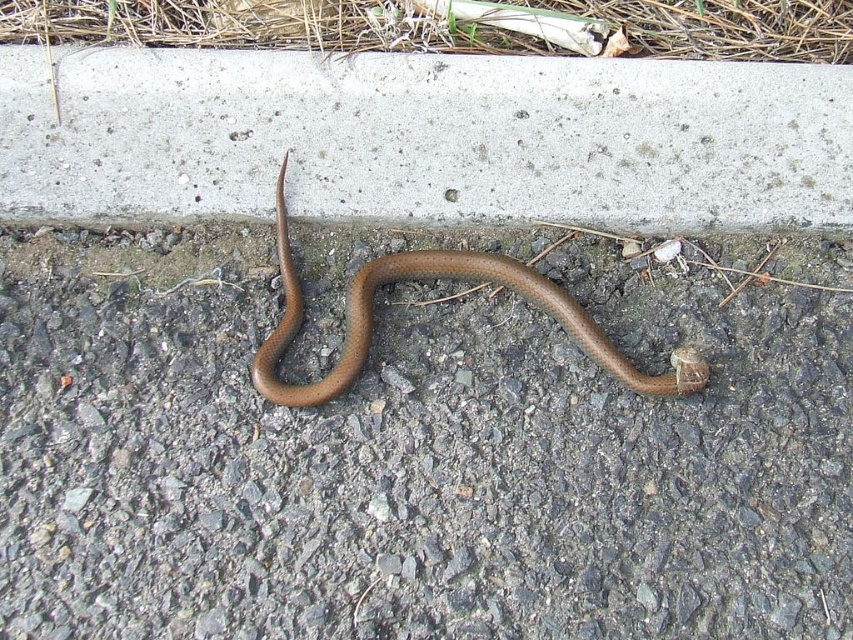
Question: Which point is farther from the camera taking this photo?

Choices:
 (A) (670, 124)
 (B) (476, 259)
 (C) (543, 556)
 (D) (721, 12)

Answer: (D)

Question: Is green grass at upper center below brown matte snake at center?

Choices:
 (A) yes
 (B) no

Answer: (B)

Question: Can you confirm if brown rubber snake at lower center is wider than gray concrete curb at upper center?

Choices:
 (A) no
 (B) yes

Answer: (B)

Question: In this image, where is brown rubber snake at lower center located relative to green grass at upper center?

Choices:
 (A) below
 (B) above

Answer: (A)

Question: Which of the following is the farthest from the observer?

Choices:
 (A) brown matte snake at center
 (B) gray concrete curb at upper center
 (C) green grass at upper center
 (D) brown rubber snake at lower center

Answer: (C)

Question: Considering the real-world distances, which object is farthest from the brown matte snake at center?

Choices:
 (A) brown rubber snake at lower center
 (B) green grass at upper center
 (C) gray concrete curb at upper center

Answer: (B)